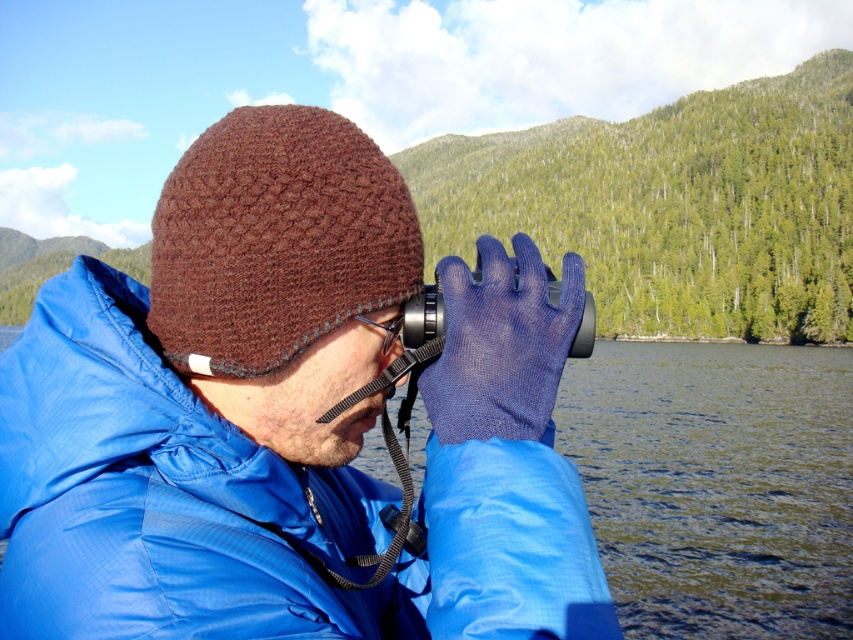
You are standing at the point labeled point (149, 433) and want to move to point (384, 348). Given that you can only move forward in a straight line, will you be moving towards or away from the dense forested area beyond the water?

Moving from point (149, 433) to point (384, 348) means moving away from the dense forested area beyond the water since point (149, 433) is closer to the viewer and the forest is in the background.

You are a photographer trying to capture the reflection of the water in the image. You notice the brown knitted hat at upper center and the black rubber goggles at center. Which object is positioned lower in the frame?

The brown knitted hat at upper center is located below the black rubber goggles at center, so it is positioned lower in the frame.

You are a photographer trying to capture the scene with a wide angle lens. You notice the brown knitted hat at upper left and the black rubber goggles at center. Which object should you focus on first if you want to ensure both are in the frame without moving the camera?

The brown knitted hat at upper left is taller than the black rubber goggles at center, so you should focus on the brown knitted hat at upper left first to ensure both are in the frame.